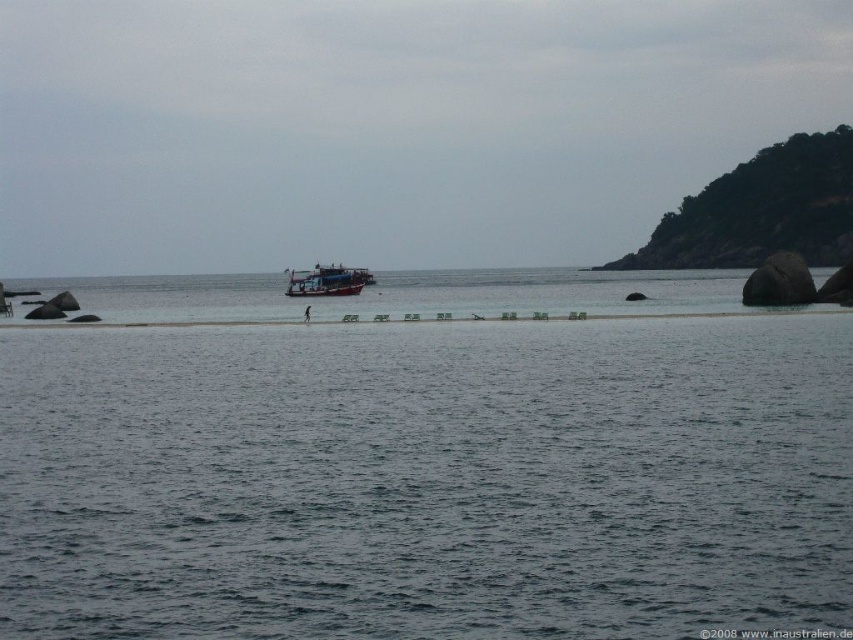
Question: Is dark blue water at center positioned in front of wooden boat at center?

Choices:
 (A) no
 (B) yes

Answer: (B)

Question: Among these objects, which one is nearest to the camera?

Choices:
 (A) wooden boat at center
 (B) dark blue water at center

Answer: (B)

Question: Considering the relative positions of dark blue water at center and wooden boat at center in the image provided, where is dark blue water at center located with respect to wooden boat at center?

Choices:
 (A) below
 (B) above

Answer: (A)

Question: Is dark blue water at center closer to camera compared to wooden boat at center?

Choices:
 (A) no
 (B) yes

Answer: (B)

Question: Which object appears farthest from the camera in this image?

Choices:
 (A) dark blue water at center
 (B) wooden boat at center

Answer: (B)